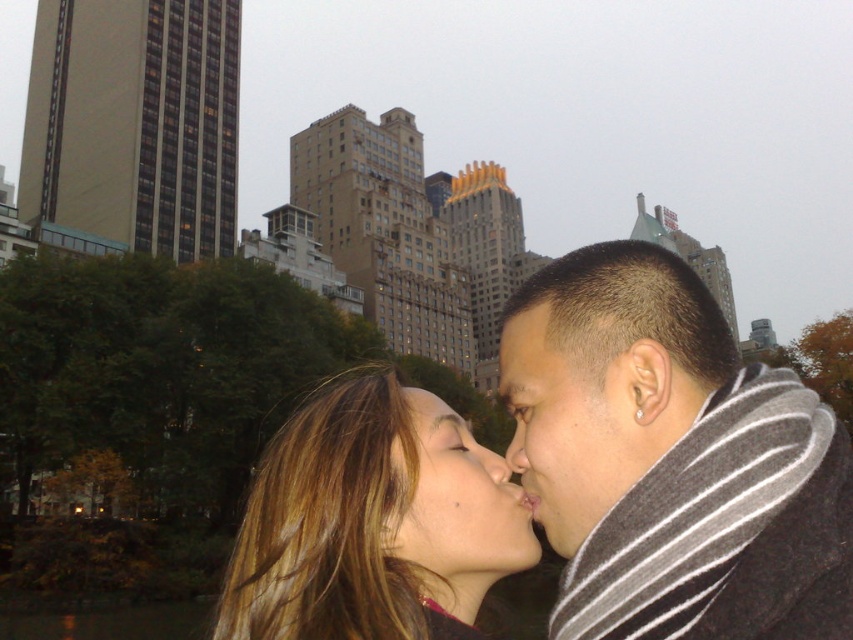
You are an architect analyzing the urban scene. You notice the matte gray scarf at right in the image. What is its exact 2D coordinate location?

The matte gray scarf at right is located at the 2D coordinate point of (570, 426).

From the picture: You are an artist sketching the scene. You notice the matte gray scarf at right and the matte skin nose at center. Which object should you draw first if you want to capture the one that is closer to the viewer?

The matte gray scarf at right should be drawn first because it is closer to the viewer than the matte skin nose at center, as smaller objects in the foreground can appear smaller but are actually nearer.

You are a photographer trying to capture the blonde hair at center in the image. The camera you are using has a focus point at coordinate point (370, 522). Will this focus point be effective for capturing the blonde hair at center?

Yes, the focus point at coordinate point (370, 522) is effective because it is positioned on the blonde hair at center, ensuring clear focus on that area.